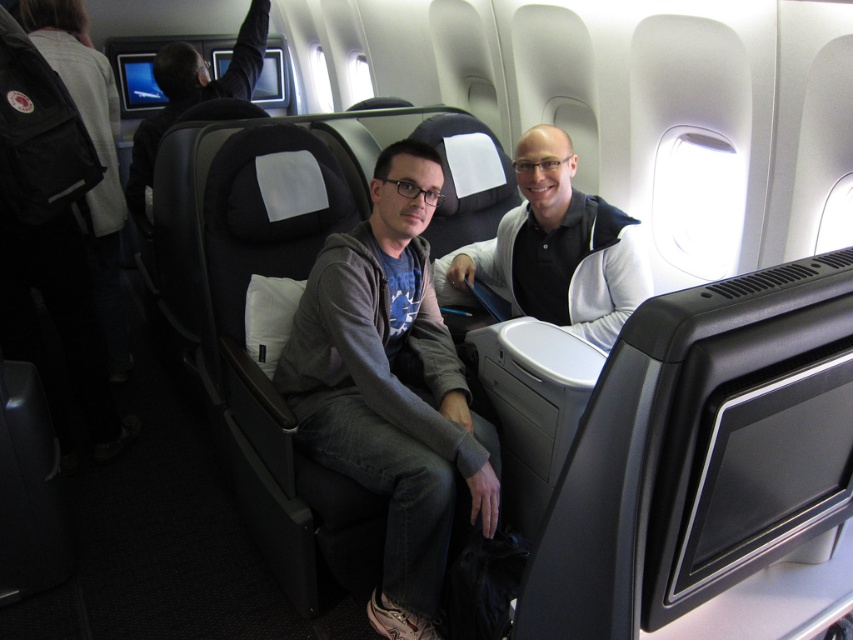
Consider the image. Can you confirm if gray hoodie at center is wider than dark gray hoodie at center?

No.

Can you confirm if gray hoodie at center is positioned to the right of dark gray hoodie at center?

Incorrect, gray hoodie at center is not on the right side of dark gray hoodie at center.

Where is `gray hoodie at center`? The image size is (853, 640). gray hoodie at center is located at coordinates (392, 388).

Locate an element on the screen. This screenshot has width=853, height=640. gray hoodie at center is located at coordinates (392, 388).

Between gray hoodie at center and black leather seat at upper left, which one is positioned lower?

Positioned lower is gray hoodie at center.

Is gray hoodie at center above black leather seat at upper left?

No.

Does point (347, 321) lie in front of point (164, 106)?

Yes.

Image resolution: width=853 pixels, height=640 pixels. I want to click on gray hoodie at center, so click(x=392, y=388).

Where is `dark gray hoodie at center`? The width and height of the screenshot is (853, 640). dark gray hoodie at center is located at coordinates 555,250.

How much distance is there between dark gray hoodie at center and black leather seat at upper left?

dark gray hoodie at center is 5.14 feet away from black leather seat at upper left.

Locate an element on the screen. This screenshot has width=853, height=640. dark gray hoodie at center is located at coordinates (555, 250).

Locate an element on the screen. dark gray hoodie at center is located at coordinates (555, 250).